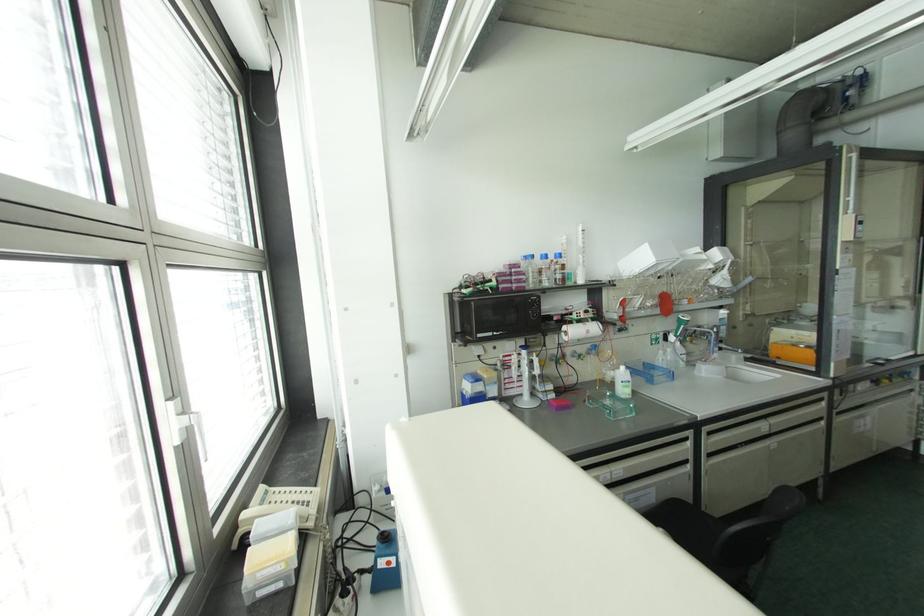
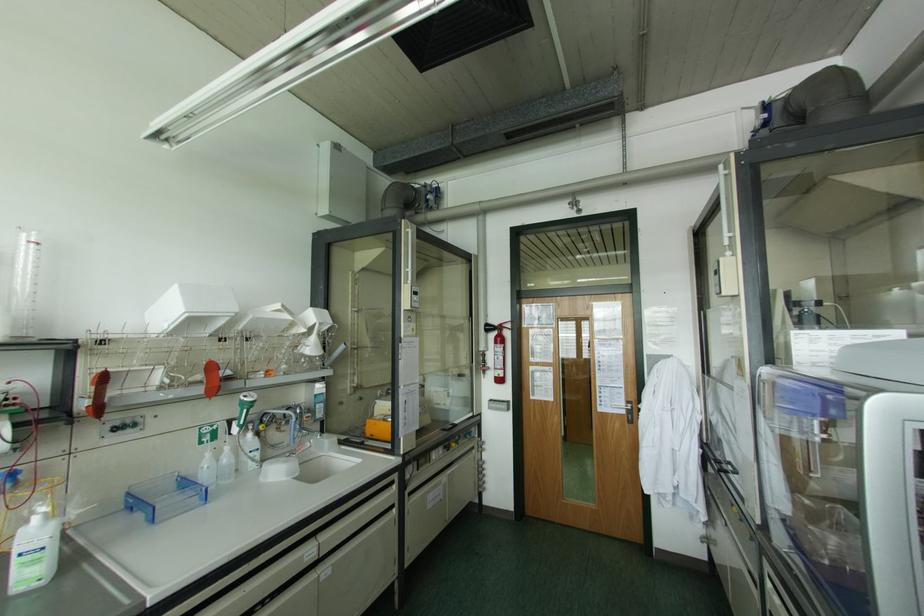
Find the pixel in the second image that matches [660,352] in the first image.

(208, 454)